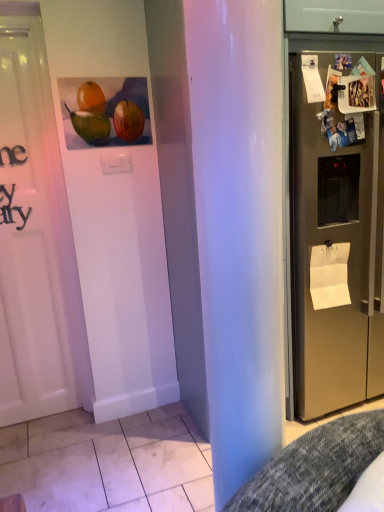
Question: Is satin silver refrigerator at right positioned before white paper at upper right, the 1th paper when ordered from top to bottom?

Choices:
 (A) yes
 (B) no

Answer: (A)

Question: From the image's perspective, would you say satin silver refrigerator at right is shown under white paper at upper right, which appears as the 2th paper when viewed from the right?

Choices:
 (A) yes
 (B) no

Answer: (A)

Question: Does satin silver refrigerator at right have a smaller size compared to white paper at upper right, the 1th paper when ordered from top to bottom?

Choices:
 (A) yes
 (B) no

Answer: (B)

Question: Is satin silver refrigerator at right positioned beyond the bounds of white paper at upper right, positioned as the 2th paper in bottom-to-top order?

Choices:
 (A) no
 (B) yes

Answer: (B)

Question: Is satin silver refrigerator at right taller than white paper at upper right, which is counted as the 1th paper, starting from the left?

Choices:
 (A) yes
 (B) no

Answer: (A)

Question: Considering the relative sizes of satin silver refrigerator at right and white paper at upper right, which appears as the 2th paper when viewed from the right, in the image provided, is satin silver refrigerator at right bigger than white paper at upper right, which appears as the 2th paper when viewed from the right,?

Choices:
 (A) yes
 (B) no

Answer: (A)

Question: From the image's perspective, does white paper at upper right, positioned as the 2th paper in bottom-to-top order, appear lower than satin silver refrigerator at right?

Choices:
 (A) no
 (B) yes

Answer: (A)

Question: Is white paper at upper right, the 1th paper when ordered from top to bottom, shorter than satin silver refrigerator at right?

Choices:
 (A) no
 (B) yes

Answer: (B)

Question: Is white paper at upper right, which is counted as the 1th paper, starting from the left, at the right side of satin silver refrigerator at right?

Choices:
 (A) no
 (B) yes

Answer: (A)

Question: From a real-world perspective, is white paper at upper right, marked as the 2th paper in a back-to-front arrangement, positioned over satin silver refrigerator at right based on gravity?

Choices:
 (A) no
 (B) yes

Answer: (B)

Question: Does white paper at upper right, positioned as the first paper in front-to-back order, appear on the left side of satin silver refrigerator at right?

Choices:
 (A) no
 (B) yes

Answer: (B)

Question: Can you confirm if white paper at upper right, positioned as the 2th paper in bottom-to-top order, is taller than satin silver refrigerator at right?

Choices:
 (A) no
 (B) yes

Answer: (A)

Question: Is satin silver refrigerator at right beside white paper at right, the first paper from the bottom?

Choices:
 (A) no
 (B) yes

Answer: (A)